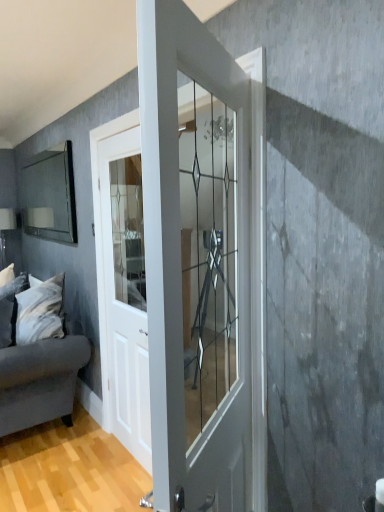
What do you see at coordinates (186, 267) in the screenshot? I see `clear glass door at center, positioned as the first door in right-to-left order` at bounding box center [186, 267].

This screenshot has height=512, width=384. I want to click on white soft pillow at left, so click(10, 308).

Where is `velvet gray couch at left`? The width and height of the screenshot is (384, 512). velvet gray couch at left is located at coordinates (40, 365).

In order to click on white glossy door at center, which is the 2th door in front-to-back order in this screenshot , I will do `click(125, 292)`.

Does point (121, 167) come in front of point (183, 346)?

No, it is not.

Is white glossy door at center, which is the 2th door in front-to-back order, oriented away from clear glass door at center, positioned as the first door in right-to-left order?

No, white glossy door at center, which is the 2th door in front-to-back order, is not facing away from clear glass door at center, positioned as the first door in right-to-left order.

Which of these two, white glossy door at center, which is the 2th door in front-to-back order, or clear glass door at center, which appears as the second door when viewed from the back, stands taller?

Standing taller between the two is white glossy door at center, which is the 2th door in front-to-back order.

In the scene shown: Which object is closer to the camera taking this photo, white glossy door at center, acting as the second door starting from the right, or clear glass door at center, positioned as the first door in right-to-left order?

Positioned in front is clear glass door at center, positioned as the first door in right-to-left order.

Is velvet gray couch at left to the left or to the right of matte glass mirror at left in the image?

Clearly, velvet gray couch at left is on the left of matte glass mirror at left in the image.

How many degrees apart are the facing directions of velvet gray couch at left and matte glass mirror at left?

There is a 10.1-degree angle between the facing directions of velvet gray couch at left and matte glass mirror at left.

Which of these two, velvet gray couch at left or matte glass mirror at left, is wider?

velvet gray couch at left is wider.

The width and height of the screenshot is (384, 512). I want to click on mirror behind the velvet gray couch at left, so (50, 196).

Between velvet gray couch at left and white soft pillow at left, which one is positioned behind?

white soft pillow at left is more distant.

Which is behind, point (21, 294) or point (11, 283)?

The point (11, 283) is farther.

The height and width of the screenshot is (512, 384). I want to click on pillow that is behind the velvet gray couch at left, so click(x=10, y=308).

Is clear glass door at center, arranged as the second door when viewed from the left, behind white soft pillow at left?

No, clear glass door at center, arranged as the second door when viewed from the left, is in front of white soft pillow at left.

Can you confirm if clear glass door at center, positioned as the first door in right-to-left order, is wider than white soft pillow at left?

No, clear glass door at center, positioned as the first door in right-to-left order, is not wider than white soft pillow at left.

From a real-world perspective, is clear glass door at center, arranged as the second door when viewed from the left, over white soft pillow at left?

Yes, from a real-world perspective, clear glass door at center, arranged as the second door when viewed from the left, is on top of white soft pillow at left.

Is clear glass door at center, arranged as the second door when viewed from the left, inside the boundaries of white soft pillow at left, or outside?

The correct answer is: outside.

From the image's perspective, which one is positioned lower, white glossy door at center, acting as the second door starting from the right, or white soft pillow at left?

white soft pillow at left, from the image's perspective.

Can you tell me how much white glossy door at center, acting as the second door starting from the right, and white soft pillow at left differ in facing direction?

The facing directions of white glossy door at center, acting as the second door starting from the right, and white soft pillow at left are 10.1 degrees apart.

Which object is thinner, white glossy door at center, acting as the second door starting from the right, or white soft pillow at left?

white glossy door at center, acting as the second door starting from the right, is thinner.

Based on the photo, based on their positions, is white glossy door at center, which is the first door in back-to-front order, located to the left or right of white soft pillow at left?

white glossy door at center, which is the first door in back-to-front order, is to the right of white soft pillow at left.

Can you tell me how much white soft pillow at left and white glossy door at center, the 1th door positioned from the left, differ in facing direction?

10.1 degrees.

At what (x,y) coordinates should I click in order to perform the action: click on pillow behind the white glossy door at center, the 1th door positioned from the left. Please return your answer as a coordinate pair (x, y). Image resolution: width=384 pixels, height=512 pixels. Looking at the image, I should click on (10, 308).

Can you confirm if white soft pillow at left is smaller than white glossy door at center, the 1th door positioned from the left?

Yes, white soft pillow at left is smaller than white glossy door at center, the 1th door positioned from the left.

Is white soft pillow at left situated inside white glossy door at center, which is the first door in back-to-front order, or outside?

white soft pillow at left is not enclosed by white glossy door at center, which is the first door in back-to-front order.

Which is behind, point (49, 192) or point (35, 377)?

The point (49, 192) is farther.

Does matte glass mirror at left turn towards velvet gray couch at left?

No, matte glass mirror at left is not aimed at velvet gray couch at left.

Is the position of matte glass mirror at left more distant than that of velvet gray couch at left?

Yes, it is behind velvet gray couch at left.

At what (x,y) coordinates should I click in order to perform the action: click on door above the white glossy door at center, which is the first door in back-to-front order (from the image's perspective). Please return your answer as a coordinate pair (x, y). The image size is (384, 512). Looking at the image, I should click on (186, 267).

You are a GUI agent. You are given a task and a screenshot of the screen. Output one action in this format:
    pyautogui.click(x=<x>, y=<y>)
    Task: Click on the studio couch below the matte glass mirror at left (from the image's perspective)
    
    Given the screenshot: What is the action you would take?
    pyautogui.click(x=40, y=365)

From the image, which object appears to be farther from white soft pillow at left, white glossy door at center, which is the 2th door in front-to-back order, or velvet gray couch at left?

Among the two, white glossy door at center, which is the 2th door in front-to-back order, is located further to white soft pillow at left.

Which object lies further to the anchor point matte glass mirror at left, velvet gray couch at left or white glossy door at center, the 1th door positioned from the left?

The object further to matte glass mirror at left is white glossy door at center, the 1th door positioned from the left.

Which object lies nearer to the anchor point matte glass mirror at left, clear glass door at center, which ranks as the 1th door in front-to-back order, or velvet gray couch at left?

velvet gray couch at left lies closer to matte glass mirror at left than the other object.

From the image, which object appears to be farther from matte glass mirror at left, white soft pillow at left or white glossy door at center, acting as the second door starting from the right?

white glossy door at center, acting as the second door starting from the right, lies further to matte glass mirror at left than the other object.

Which object lies further to the anchor point white glossy door at center, which is the 2th door in front-to-back order, velvet gray couch at left or clear glass door at center, arranged as the second door when viewed from the left?

Among the two, clear glass door at center, arranged as the second door when viewed from the left, is located further to white glossy door at center, which is the 2th door in front-to-back order.

Estimate the real-world distances between objects in this image. Which object is closer to clear glass door at center, which ranks as the 1th door in front-to-back order, white glossy door at center, which is the 2th door in front-to-back order, or white soft pillow at left?

white glossy door at center, which is the 2th door in front-to-back order, is closer to clear glass door at center, which ranks as the 1th door in front-to-back order.

Looking at the image, which one is located further to clear glass door at center, which appears as the second door when viewed from the back, white glossy door at center, which is the first door in back-to-front order, or matte glass mirror at left?

matte glass mirror at left is further to clear glass door at center, which appears as the second door when viewed from the back.

Based on their spatial positions, is white glossy door at center, acting as the second door starting from the right, or velvet gray couch at left further from matte glass mirror at left?

white glossy door at center, acting as the second door starting from the right, lies further to matte glass mirror at left than the other object.

Where is `pillow between matte glass mirror at left and velvet gray couch at left from top to bottom`? This screenshot has width=384, height=512. pillow between matte glass mirror at left and velvet gray couch at left from top to bottom is located at coordinates (10, 308).

Where is `pillow between matte glass mirror at left and white glossy door at center, which is the 2th door in front-to-back order, from left to right`? pillow between matte glass mirror at left and white glossy door at center, which is the 2th door in front-to-back order, from left to right is located at coordinates (10, 308).

The width and height of the screenshot is (384, 512). What are the coordinates of `door positioned between clear glass door at center, positioned as the first door in right-to-left order, and velvet gray couch at left from near to far` in the screenshot? It's located at (125, 292).

You are a GUI agent. You are given a task and a screenshot of the screen. Output one action in this format:
    pyautogui.click(x=<x>, y=<y>)
    Task: Click on the pillow located between velvet gray couch at left and white glossy door at center, the 1th door positioned from the left, in the left-right direction
    
    Given the screenshot: What is the action you would take?
    pyautogui.click(x=10, y=308)